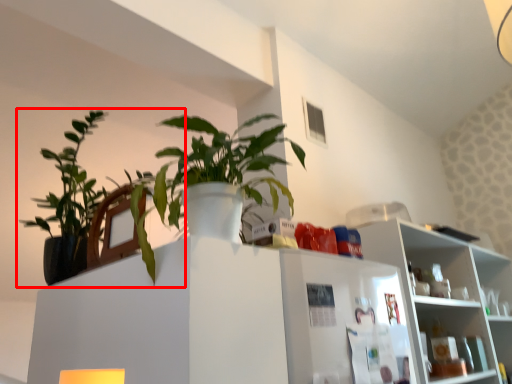
Question: Where is houseplant (annotated by the red box) located in relation to shelf in the image?

Choices:
 (A) left
 (B) right

Answer: (A)